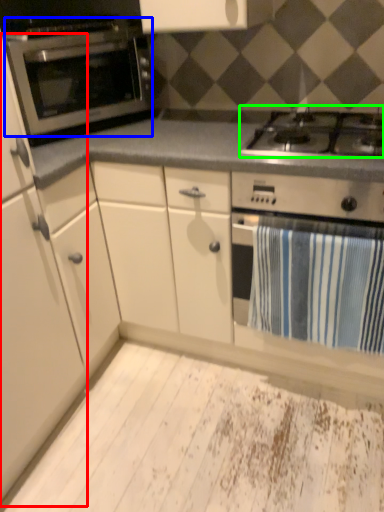
Question: Estimate the real-world distances between objects in this image. Which object is closer to cabinetry (highlighted by a red box), oven (highlighted by a blue box) or gas stove (highlighted by a green box)?

Choices:
 (A) oven
 (B) gas stove

Answer: (A)